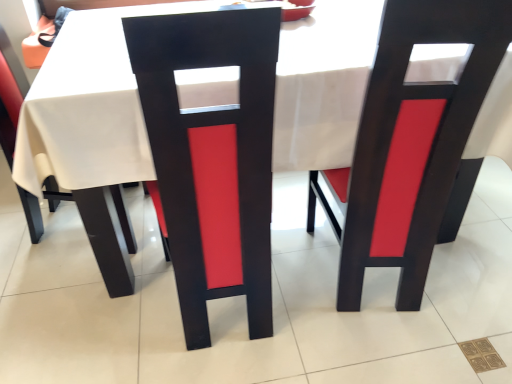
I want to click on free space in front of matte black chair at center, which is the 3th chair from left to right, so click(x=387, y=346).